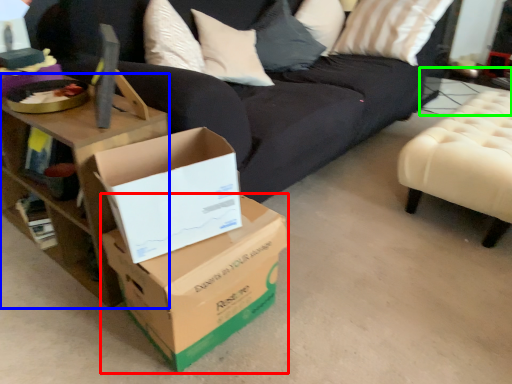
Question: Estimate the real-world distances between objects in this image. Which object is closer to box (highlighted by a red box), table (highlighted by a blue box) or side table (highlighted by a green box)?

Choices:
 (A) table
 (B) side table

Answer: (A)